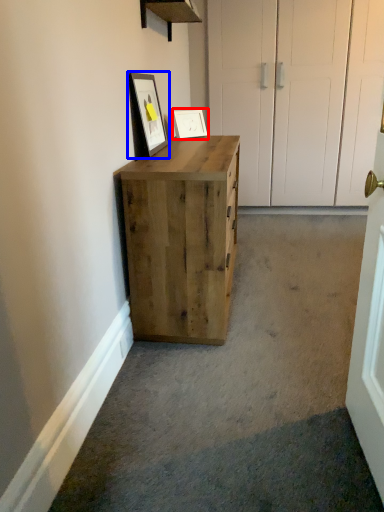
Question: Which point is further to the camera, picture frame (highlighted by a red box) or picture frame (highlighted by a blue box)?

Choices:
 (A) picture frame
 (B) picture frame

Answer: (A)